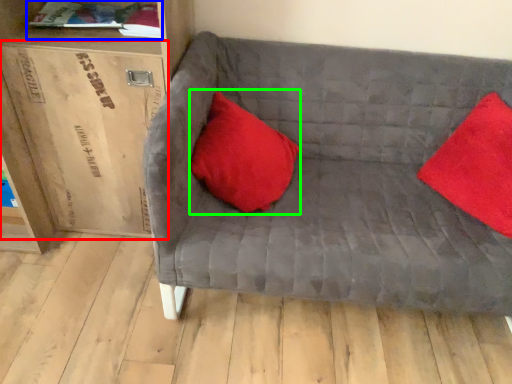
Question: Which is farther away from cardboard box (highlighted by a red box)? book (highlighted by a blue box) or pillow (highlighted by a green box)?

Choices:
 (A) book
 (B) pillow

Answer: (B)